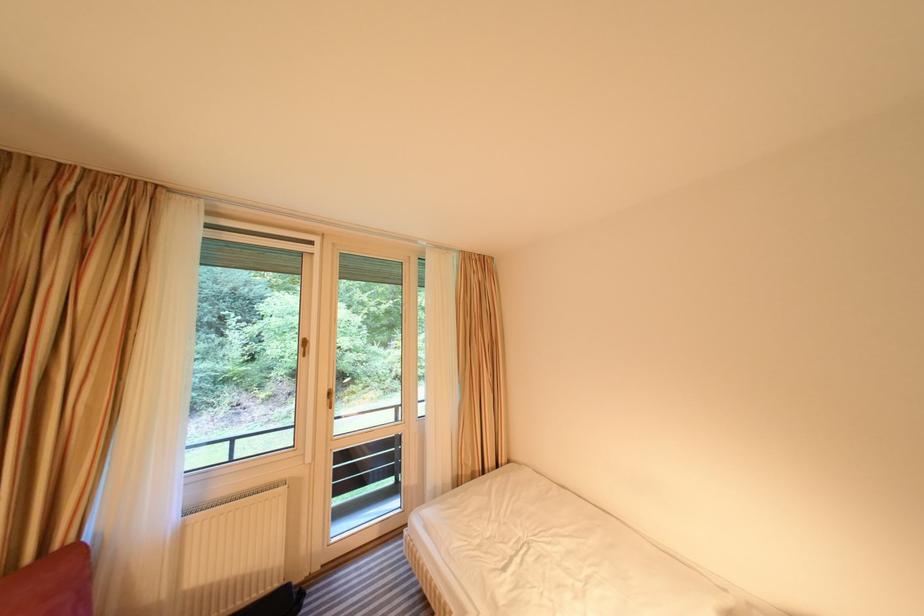
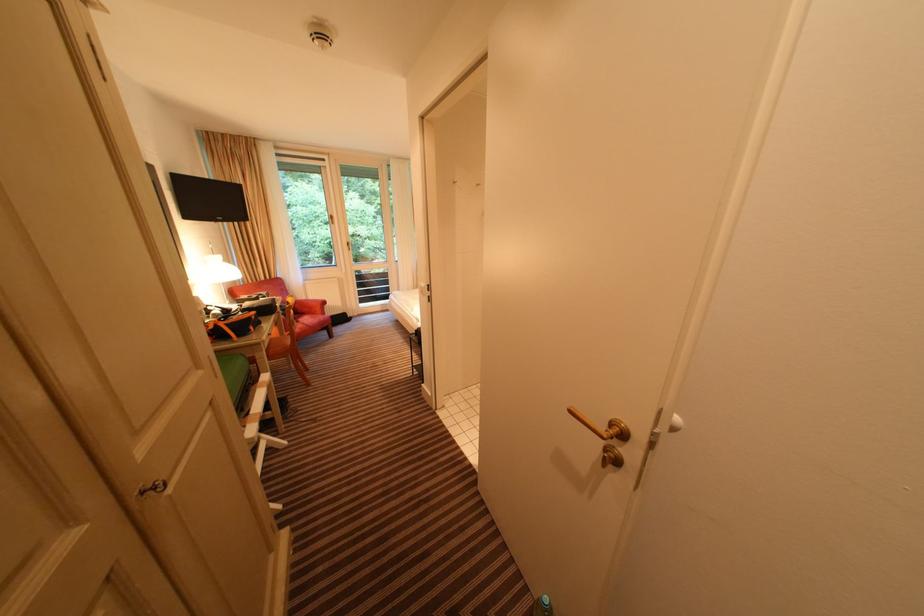
What movement of the cameraman would produce the second image?

The cameraman moved toward right, backward.